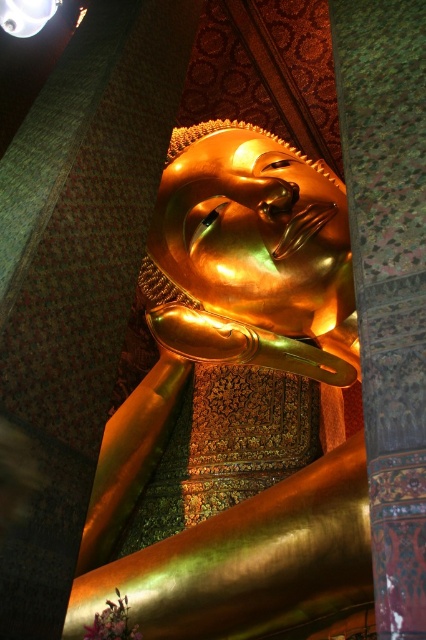
Question: Does gold polished statue at center have a larger size compared to metallic dome at upper left?

Choices:
 (A) yes
 (B) no

Answer: (A)

Question: Which point is farther to the camera?

Choices:
 (A) (19, 33)
 (B) (111, 428)

Answer: (B)

Question: Is gold polished statue at center to the left of metallic dome at upper left from the viewer's perspective?

Choices:
 (A) no
 (B) yes

Answer: (A)

Question: Does gold polished statue at center come behind metallic dome at upper left?

Choices:
 (A) yes
 (B) no

Answer: (B)